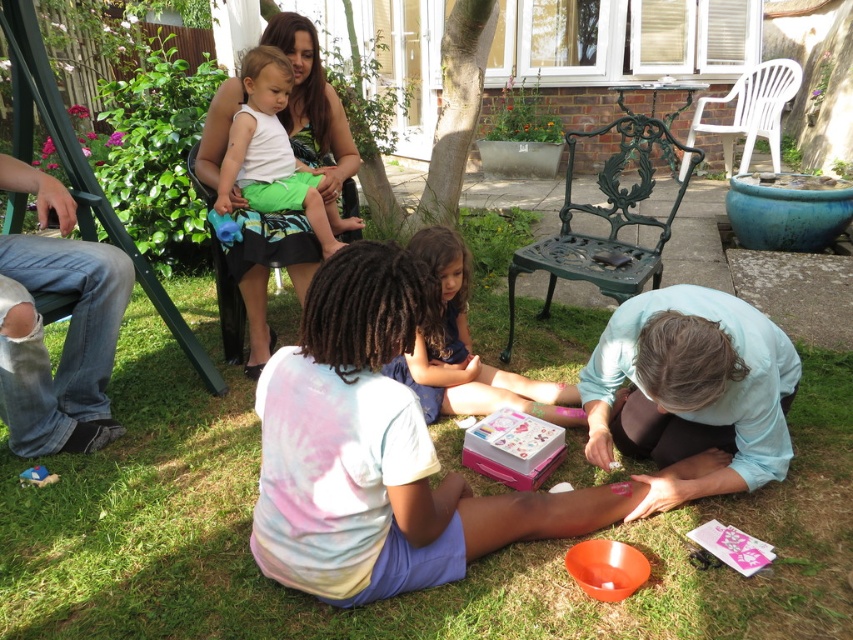
Does light blue fabric at lower right have a greater height compared to smooth blue dress at center?

Incorrect, light blue fabric at lower right's height is not larger of smooth blue dress at center's.

Who is more forward, (743, 388) or (450, 332)?

Point (743, 388)

The image size is (853, 640). In order to click on light blue fabric at lower right in this screenshot , I will do `click(692, 388)`.

Which of these two, light blue fabric at lower right or ripped denim jeans at lower left, stands shorter?

Standing shorter between the two is light blue fabric at lower right.

Is light blue fabric at lower right smaller than ripped denim jeans at lower left?

No.

I want to click on light blue fabric at lower right, so click(x=692, y=388).

Does green grass at lower center have a smaller size compared to light blue fabric at lower right?

Incorrect, green grass at lower center is not smaller in size than light blue fabric at lower right.

Can you confirm if green grass at lower center is bigger than light blue fabric at lower right?

Indeed, green grass at lower center has a larger size compared to light blue fabric at lower right.

Does point (773, 616) come behind point (705, 321)?

No, it is in front of (705, 321).

Image resolution: width=853 pixels, height=640 pixels. I want to click on green grass at lower center, so click(x=390, y=598).